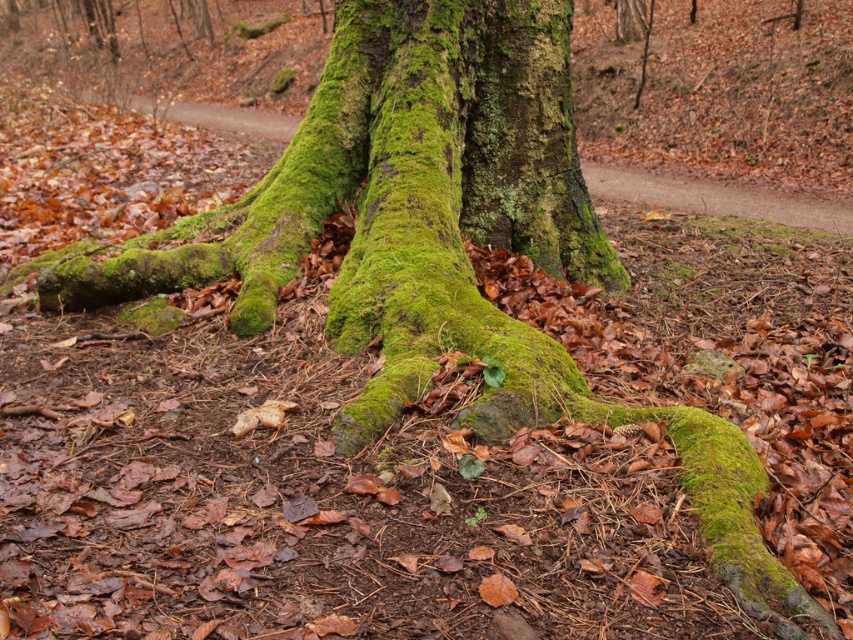
Question: Among these objects, which one is nearest to the camera?

Choices:
 (A) green mossy tree roots at center
 (B) green mossy bark at center

Answer: (B)

Question: Which object is farther from the camera taking this photo?

Choices:
 (A) green mossy tree roots at center
 (B) green mossy bark at center

Answer: (A)

Question: Which point appears farthest from the camera in this image?

Choices:
 (A) (463, 170)
 (B) (654, 177)

Answer: (B)

Question: Does green mossy bark at center appear on the left side of green mossy tree roots at center?

Choices:
 (A) no
 (B) yes

Answer: (A)

Question: Does green mossy bark at center lie behind green mossy tree roots at center?

Choices:
 (A) yes
 (B) no

Answer: (B)

Question: Can you confirm if green mossy bark at center is smaller than green mossy tree roots at center?

Choices:
 (A) no
 (B) yes

Answer: (B)